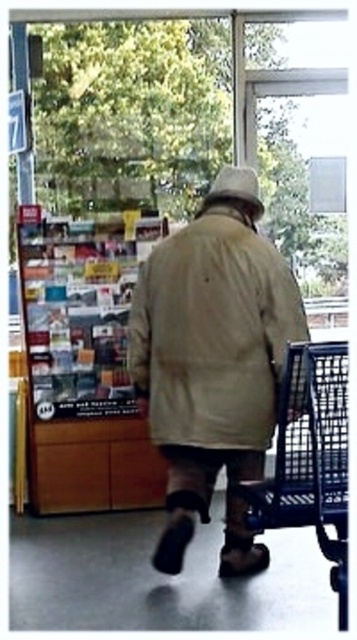
Is khaki cotton jacket at center thinner than white fabric hat at upper center?

No, khaki cotton jacket at center is not thinner than white fabric hat at upper center.

Is khaki cotton jacket at center smaller than white fabric hat at upper center?

Answer: Actually, khaki cotton jacket at center might be larger than white fabric hat at upper center.

Describe the element at coordinates (213, 333) in the screenshot. I see `khaki cotton jacket at center` at that location.

Identify the location of khaki cotton jacket at center. Image resolution: width=357 pixels, height=640 pixels. (213, 333).

What do you see at coordinates (309, 458) in the screenshot?
I see `metallic blue shopping cart at right` at bounding box center [309, 458].

Does metallic blue shopping cart at right have a larger size compared to white fabric hat at upper center?

Indeed, metallic blue shopping cart at right has a larger size compared to white fabric hat at upper center.

Who is more forward, (334, 454) or (250, 204)?

Point (334, 454)

Where is `metallic blue shopping cart at right`? The height and width of the screenshot is (640, 357). metallic blue shopping cart at right is located at coordinates (309, 458).

Can you confirm if khaki cotton jacket at center is positioned to the left of metallic blue shopping cart at right?

Indeed, khaki cotton jacket at center is positioned on the left side of metallic blue shopping cart at right.

This screenshot has width=357, height=640. I want to click on khaki cotton jacket at center, so pos(213,333).

The image size is (357, 640). In order to click on khaki cotton jacket at center in this screenshot , I will do pos(213,333).